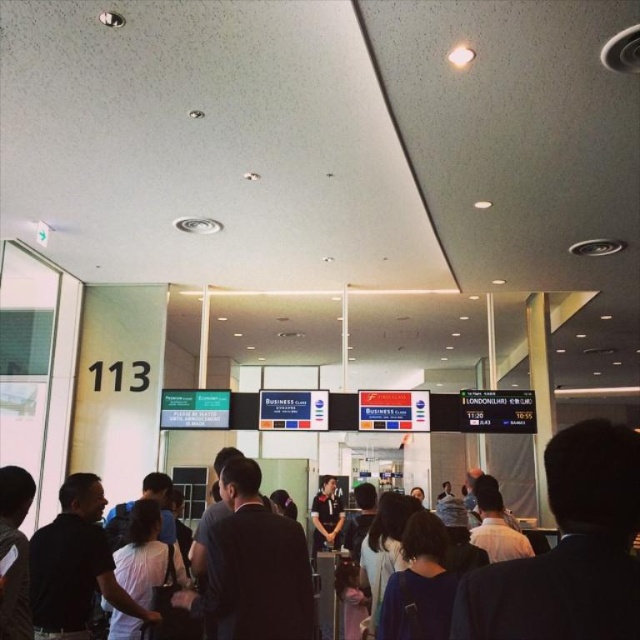
Question: Based on their relative distances, which object is farther from the dark blue suit at right?

Choices:
 (A) dark blue shirt at center
 (B) white fabric bag at center

Answer: (B)

Question: Does dark blue shirt at center appear under white fabric bag at center?

Choices:
 (A) yes
 (B) no

Answer: (B)

Question: Which point is farther to the camera?

Choices:
 (A) (116, 616)
 (B) (413, 582)
 (C) (593, 531)

Answer: (A)

Question: Among these points, which one is nearest to the camera?

Choices:
 (A) (560, 465)
 (B) (419, 625)
 (C) (138, 636)

Answer: (A)

Question: Is dark blue suit at right closer to the viewer compared to dark blue shirt at center?

Choices:
 (A) no
 (B) yes

Answer: (B)

Question: Does dark blue suit at right have a lesser width compared to dark blue shirt at center?

Choices:
 (A) no
 (B) yes

Answer: (A)